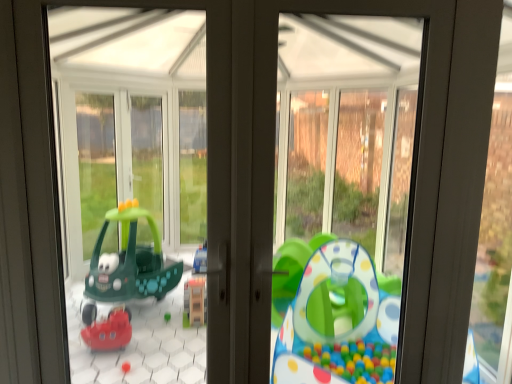
What do you see at coordinates (132, 163) in the screenshot? I see `green plastic toy boat at left` at bounding box center [132, 163].

Where is `green plastic toy boat at left`? green plastic toy boat at left is located at coordinates (132, 163).

Locate an element on the screen. The image size is (512, 384). matte gray window frame at right is located at coordinates (350, 132).

The width and height of the screenshot is (512, 384). Describe the element at coordinates (350, 132) in the screenshot. I see `matte gray window frame at right` at that location.

The image size is (512, 384). I want to click on green plastic toy boat at left, so click(132, 163).

In the scene shown: Is green plastic toy boat at left to the right of matte gray window frame at right from the viewer's perspective?

Incorrect, green plastic toy boat at left is not on the right side of matte gray window frame at right.

Considering the relative positions of green plastic toy boat at left and matte gray window frame at right in the image provided, is green plastic toy boat at left behind matte gray window frame at right?

No, it is not.

Is point (159, 87) closer to camera compared to point (328, 39)?

No, it is not.

From the image's perspective, is green plastic toy boat at left above or below matte gray window frame at right?

green plastic toy boat at left is above matte gray window frame at right.

From a real-world perspective, is green plastic toy boat at left above or below matte gray window frame at right?

In terms of real-world spatial position, green plastic toy boat at left is above matte gray window frame at right.

Between green plastic toy boat at left and matte gray window frame at right, which one has smaller width?

green plastic toy boat at left is thinner.

From the picture: Which of these two, green plastic toy boat at left or matte gray window frame at right, stands shorter?

Standing shorter between the two is green plastic toy boat at left.

From the picture: Who is bigger, green plastic toy boat at left or matte gray window frame at right?

Bigger between the two is matte gray window frame at right.

Could matte gray window frame at right be considered to be inside green plastic toy boat at left?

That's incorrect, matte gray window frame at right is not inside green plastic toy boat at left.

Can you see green plastic toy boat at left touching matte gray window frame at right?

green plastic toy boat at left is not next to matte gray window frame at right, and they're not touching.

Could you tell me if green plastic toy boat at left is turned towards matte gray window frame at right?

No, green plastic toy boat at left is not facing towards matte gray window frame at right.

At what (x,y) coordinates should I click in order to perform the action: click on window frame below the green plastic toy boat at left (from a real-world perspective). Please return your answer as a coordinate pair (x, y). The image size is (512, 384). Looking at the image, I should click on pos(350,132).

Between matte gray window frame at right and green plastic toy boat at left, which one appears on the left side from the viewer's perspective?

From the viewer's perspective, green plastic toy boat at left appears more on the left side.

Does matte gray window frame at right come in front of green plastic toy boat at left?

No, matte gray window frame at right is further to the viewer.

Is point (353, 130) in front of point (99, 160)?

No, (353, 130) is further to viewer.

From the image's perspective, is matte gray window frame at right under green plastic toy boat at left?

Indeed, from the image's perspective, matte gray window frame at right is shown beneath green plastic toy boat at left.

From a real-world perspective, is matte gray window frame at right beneath green plastic toy boat at left?

Indeed, from a real-world perspective, matte gray window frame at right is positioned beneath green plastic toy boat at left.

Which object is wider, matte gray window frame at right or green plastic toy boat at left?

matte gray window frame at right is wider.

Based on the photo, which of these two, matte gray window frame at right or green plastic toy boat at left, stands shorter?

green plastic toy boat at left.

In the scene shown: Which of these two, matte gray window frame at right or green plastic toy boat at left, is bigger?

matte gray window frame at right.

Do you think matte gray window frame at right is within green plastic toy boat at left, or outside of it?

matte gray window frame at right is outside green plastic toy boat at left.

Is matte gray window frame at right next to green plastic toy boat at left and touching it?

There is a gap between matte gray window frame at right and green plastic toy boat at left.

Is matte gray window frame at right oriented away from green plastic toy boat at left?

No, green plastic toy boat at left is not at the back of matte gray window frame at right.

Can you tell me how much matte gray window frame at right and green plastic toy boat at left differ in facing direction?

2.02 degrees separate the facing orientations of matte gray window frame at right and green plastic toy boat at left.

In the image, there is a green plastic toy boat at left. Where is `window frame below it (from the image's perspective)`? The image size is (512, 384). window frame below it (from the image's perspective) is located at coordinates (350, 132).

Where is `window frame below the green plastic toy boat at left (from the image's perspective)`? This screenshot has height=384, width=512. window frame below the green plastic toy boat at left (from the image's perspective) is located at coordinates (350, 132).

Locate an element on the screen. window frame on the right of green plastic toy boat at left is located at coordinates (350, 132).